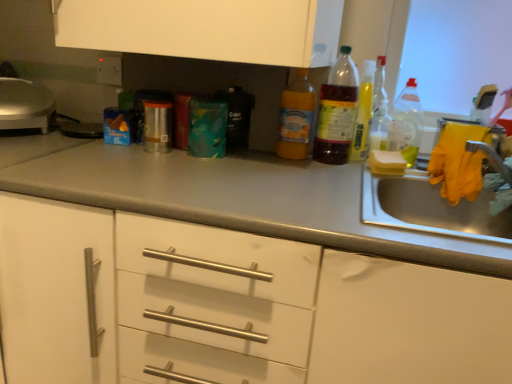
Question: Can you confirm if translucent plastic bottle at upper right, the third bottle in the left-to-right sequence, is thinner than gray matte countertop at center?

Choices:
 (A) no
 (B) yes

Answer: (B)

Question: Does translucent plastic bottle at upper right, the third bottle in the left-to-right sequence, turn towards gray matte countertop at center?

Choices:
 (A) no
 (B) yes

Answer: (A)

Question: From the image's perspective, is translucent plastic bottle at upper right, the third bottle in the left-to-right sequence, beneath gray matte countertop at center?

Choices:
 (A) no
 (B) yes

Answer: (A)

Question: Is translucent plastic bottle at upper right, the third bottle in the left-to-right sequence, positioned far away from gray matte countertop at center?

Choices:
 (A) yes
 (B) no

Answer: (B)

Question: Is translucent plastic bottle at upper right, arranged as the third bottle when viewed from the right, at the left side of gray matte countertop at center?

Choices:
 (A) yes
 (B) no

Answer: (B)

Question: Which is correct: gray matte countertop at center is inside translucent plastic bottle at center, which ranks as the fourth bottle in right-to-left order, or outside of it?

Choices:
 (A) inside
 (B) outside

Answer: (B)

Question: From the image's perspective, is gray matte countertop at center above or below translucent plastic bottle at center, which ranks as the fourth bottle in right-to-left order?

Choices:
 (A) above
 (B) below

Answer: (B)

Question: From a real-world perspective, is gray matte countertop at center positioned above or below translucent plastic bottle at center, the 2th bottle in the left-to-right sequence?

Choices:
 (A) above
 (B) below

Answer: (B)

Question: Is point (473, 266) closer or farther from the camera than point (347, 82)?

Choices:
 (A) farther
 (B) closer

Answer: (B)

Question: Is point (322, 102) closer or farther from the camera than point (356, 148)?

Choices:
 (A) farther
 (B) closer

Answer: (B)

Question: Considering the positions of translucent plastic bottle at center, which ranks as the fourth bottle in right-to-left order, and translucent plastic bottle at upper right, arranged as the third bottle when viewed from the right, in the image, is translucent plastic bottle at center, which ranks as the fourth bottle in right-to-left order, taller or shorter than translucent plastic bottle at upper right, arranged as the third bottle when viewed from the right,?

Choices:
 (A) short
 (B) tall

Answer: (B)

Question: Is translucent plastic bottle at center, the 2th bottle in the left-to-right sequence, inside the boundaries of translucent plastic bottle at upper right, arranged as the third bottle when viewed from the right, or outside?

Choices:
 (A) inside
 (B) outside

Answer: (B)

Question: Visually, is translucent plastic bottle at center, which ranks as the fourth bottle in right-to-left order, positioned to the left or to the right of translucent plastic bottle at upper right, arranged as the third bottle when viewed from the right?

Choices:
 (A) left
 (B) right

Answer: (A)

Question: From a real-world perspective, is white sponge at sink physically located above or below translucent plastic bottle at center, the 2th bottle in the left-to-right sequence?

Choices:
 (A) above
 (B) below

Answer: (B)

Question: Is white sponge at sink bigger or smaller than translucent plastic bottle at center, which ranks as the fourth bottle in right-to-left order?

Choices:
 (A) big
 (B) small

Answer: (B)